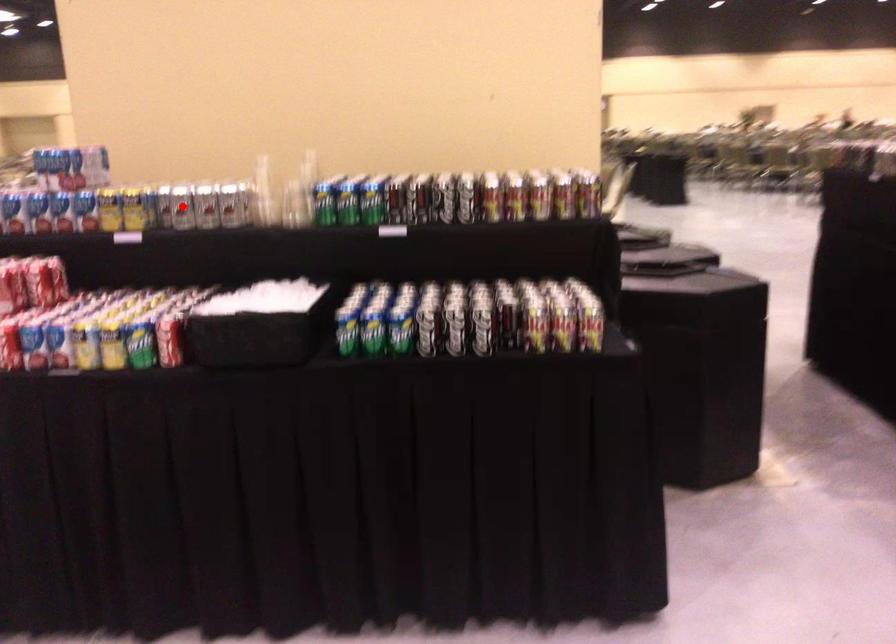
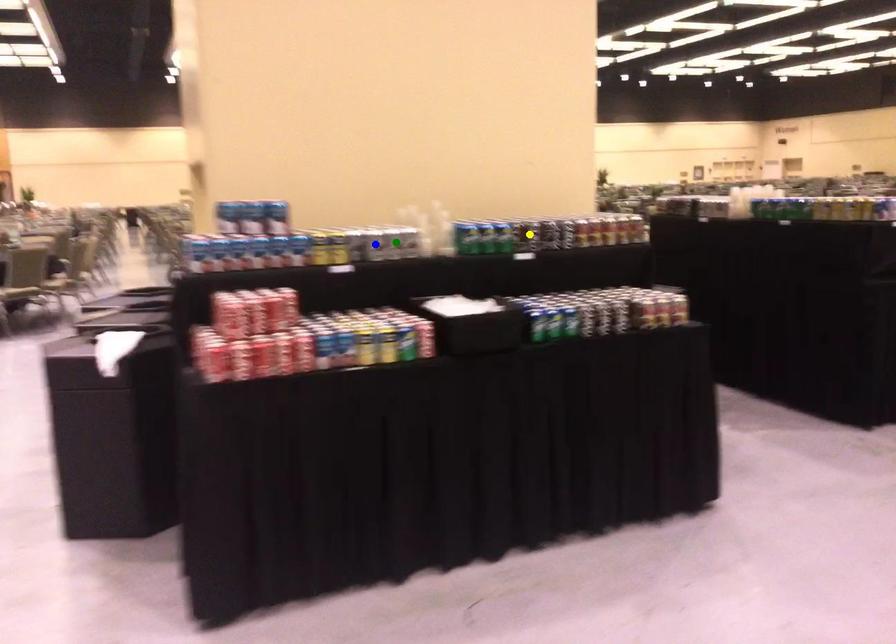
Question: I am providing you with two images of the same scene from different viewpoints. A red point is marked on the first image. You are given multiple points on the second image. Can you choose the point in image 2 that corresponds to the point in image 1?

Choices:
 (A) yellow point
 (B) blue point
 (C) green point

Answer: (B)